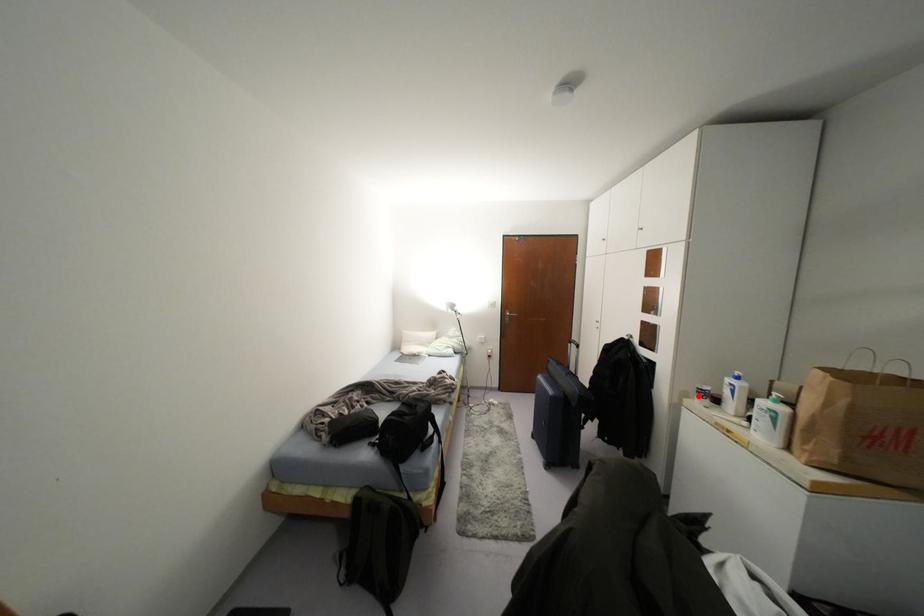
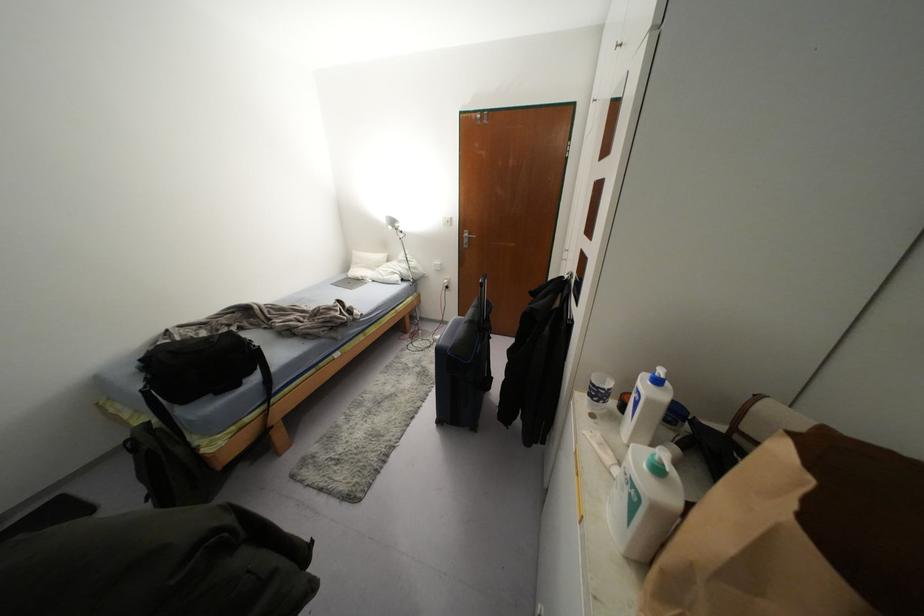
Question: I am providing you with two images of the same scene from different viewpoints. A red point is marked on the first image. Is the red point's position out of view in image 2?

Choices:
 (A) Yes
 (B) No

Answer: (B)